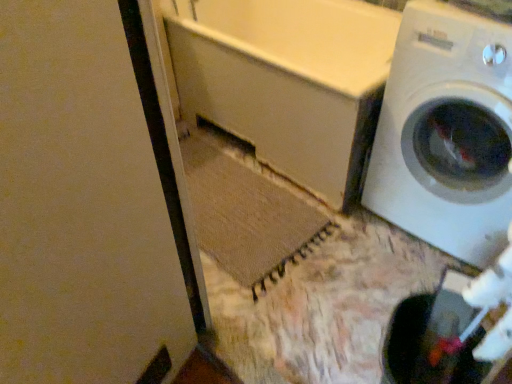
Question: Could white matte bathtub at center be considered to be inside white matte screen door at upper left?

Choices:
 (A) no
 (B) yes

Answer: (A)

Question: Can you confirm if white matte screen door at upper left is smaller than white matte bathtub at center?

Choices:
 (A) yes
 (B) no

Answer: (A)

Question: Does white matte screen door at upper left appear on the right side of white matte bathtub at center?

Choices:
 (A) yes
 (B) no

Answer: (B)

Question: Does white matte screen door at upper left have a greater height compared to white matte bathtub at center?

Choices:
 (A) yes
 (B) no

Answer: (A)

Question: From a real-world perspective, is white matte screen door at upper left physically above white matte bathtub at center?

Choices:
 (A) yes
 (B) no

Answer: (A)

Question: From the image's perspective, relative to white matte bathtub at center, is white matte screen door at upper left above or below?

Choices:
 (A) above
 (B) below

Answer: (B)

Question: From a real-world perspective, is white matte screen door at upper left above or below white matte bathtub at center?

Choices:
 (A) above
 (B) below

Answer: (A)

Question: Does point (109, 122) appear closer or farther from the camera than point (242, 44)?

Choices:
 (A) closer
 (B) farther

Answer: (A)

Question: Is white matte screen door at upper left taller or shorter than white matte bathtub at center?

Choices:
 (A) tall
 (B) short

Answer: (A)

Question: From their relative heights in the image, would you say white glossy washing machine at right is taller or shorter than white matte screen door at upper left?

Choices:
 (A) short
 (B) tall

Answer: (A)

Question: From the image's perspective, is white glossy washing machine at right located above or below white matte screen door at upper left?

Choices:
 (A) above
 (B) below

Answer: (A)

Question: Considering their positions, is white glossy washing machine at right located in front of or behind white matte screen door at upper left?

Choices:
 (A) front
 (B) behind

Answer: (B)

Question: Based on their sizes in the image, would you say white glossy washing machine at right is bigger or smaller than white matte screen door at upper left?

Choices:
 (A) big
 (B) small

Answer: (A)

Question: From a real-world perspective, relative to white glossy washing machine at right, is white matte screen door at upper left vertically above or below?

Choices:
 (A) below
 (B) above

Answer: (B)

Question: Based on their positions, is white matte screen door at upper left located to the left or right of white glossy washing machine at right?

Choices:
 (A) left
 (B) right

Answer: (A)